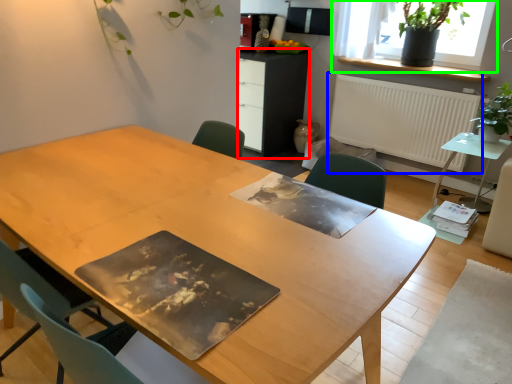
Question: Which is farther away from computer desk (highlighted by a red box)? radiator (highlighted by a blue box) or window (highlighted by a green box)?

Choices:
 (A) radiator
 (B) window

Answer: (B)